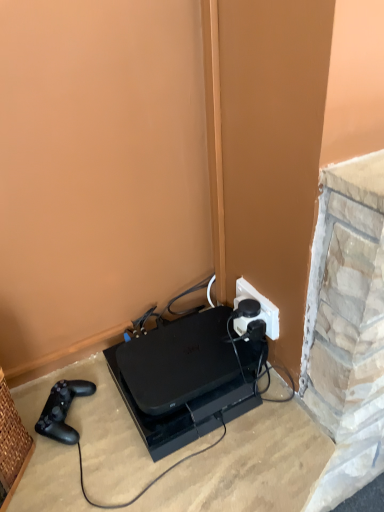
Question: Relative to black plastic gaming console at lower center, is white plastic power plugs and sockets at center-right in front or behind?

Choices:
 (A) behind
 (B) front

Answer: (A)

Question: From a real-world perspective, is white plastic power plugs and sockets at center-right positioned above or below black plastic gaming console at lower center?

Choices:
 (A) below
 (B) above

Answer: (B)

Question: Based on their relative distances, which object is nearer to the black plastic gaming console at lower center?

Choices:
 (A) black matte game controller at lower left
 (B) white plastic power plugs and sockets at center-right

Answer: (B)

Question: Which object is positioned closest to the black plastic gaming console at lower center?

Choices:
 (A) white plastic power plugs and sockets at center-right
 (B) black matte game controller at lower left

Answer: (A)